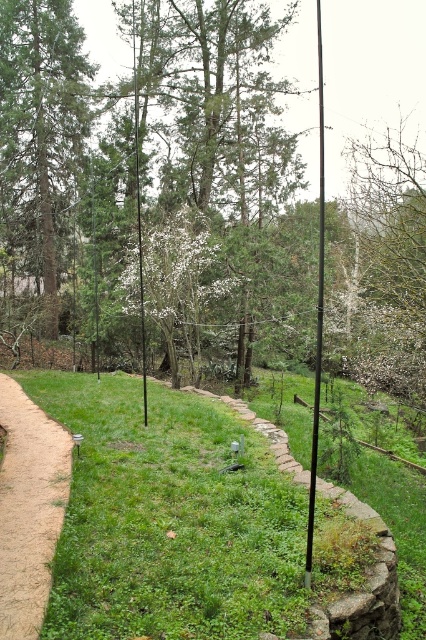
What are the coordinates of `green grass at center` in the screenshot? It's located at (32, 509).

Can you confirm if green grass at center is thinner than white textured tree at center?

Yes.

Between point (17, 541) and point (132, 264), which one is positioned in front?

Point (17, 541) is more forward.

Find the location of a particular element. This screenshot has width=426, height=640. green grass at center is located at coordinates (32, 509).

Is green leafy tree at center in front of brown dirt path at left?

No, green leafy tree at center is further to the viewer.

Looking at this image, does green leafy tree at center appear under brown dirt path at left?

No, green leafy tree at center is not below brown dirt path at left.

Is point (235, 186) farther from camera compared to point (31, 474)?

That is True.

Where is `green leafy tree at center`? The height and width of the screenshot is (640, 426). green leafy tree at center is located at coordinates (218, 106).

Which is behind, point (180, 336) or point (137, 161)?

The point (137, 161) is more distant.

Does white textured tree at center appear over green matte pole at center?

Incorrect, white textured tree at center is not positioned above green matte pole at center.

Find the location of a particular element. The width and height of the screenshot is (426, 640). white textured tree at center is located at coordinates (183, 284).

Where is `white textured tree at center`? white textured tree at center is located at coordinates (183, 284).